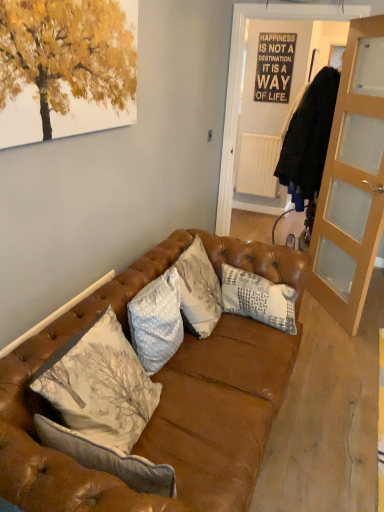
How much space does light gray textured pillow at center, placed as the second pillow when sorted from back to front, occupy horizontally?

The width of light gray textured pillow at center, placed as the second pillow when sorted from back to front, is 7.48 inches.

The height and width of the screenshot is (512, 384). I want to click on light gray textured pillow at center, placed as the second pillow when sorted from back to front, so click(x=156, y=321).

Consider the image. Is gray textured pillow at center, which is the 2th pillow in left-to-right order, oriented away from black paper poster at upper center?

Correct, gray textured pillow at center, which is the 2th pillow in left-to-right order, is looking away from black paper poster at upper center.

Considering the relative sizes of gray textured pillow at center, which is the first pillow in back-to-front order, and black paper poster at upper center in the image provided, is gray textured pillow at center, which is the first pillow in back-to-front order, shorter than black paper poster at upper center?

Yes, gray textured pillow at center, which is the first pillow in back-to-front order, is shorter than black paper poster at upper center.

From the picture: From the image's perspective, would you say gray textured pillow at center, which is the first pillow in back-to-front order, is shown under black paper poster at upper center?

Indeed, from the image's perspective, gray textured pillow at center, which is the first pillow in back-to-front order, is shown beneath black paper poster at upper center.

Does gray textured pillow at center, acting as the 2th pillow starting from the front, have a greater width compared to black paper poster at upper center?

Correct, the width of gray textured pillow at center, acting as the 2th pillow starting from the front, exceeds that of black paper poster at upper center.

Is white matte radiator at center closer to the viewer compared to leather couch at center?

No, it is behind leather couch at center.

Is white matte radiator at center looking in the opposite direction of leather couch at center?

No, white matte radiator at center's orientation is not away from leather couch at center.

In terms of size, does white matte radiator at center appear bigger or smaller than leather couch at center?

In the image, white matte radiator at center appears to be smaller than leather couch at center.

Is white matte radiator at center touching leather couch at center?

white matte radiator at center and leather couch at center are clearly separated.

Considering the relative sizes of leather couch at center and light brown glass cabinet at right in the image provided, is leather couch at center smaller than light brown glass cabinet at right?

Incorrect, leather couch at center is not smaller in size than light brown glass cabinet at right.

Between point (9, 354) and point (334, 238), which one is positioned in front?

The point (9, 354) is closer to the camera.

Is leather couch at center positioned beyond the bounds of light brown glass cabinet at right?

leather couch at center is positioned outside light brown glass cabinet at right.

Is light brown glass cabinet at right in contact with gray textured pillow at center, the first pillow positioned from the right?

They are not placed beside each other.

Which object is positioned more to the left, light brown glass cabinet at right or gray textured pillow at center, which is the 2th pillow in left-to-right order?

Positioned to the left is gray textured pillow at center, which is the 2th pillow in left-to-right order.

Is gray textured pillow at center, which is the 2th pillow in left-to-right order, located within light brown glass cabinet at right?

No.

Considering the points (348, 290) and (245, 281), which point is in front, point (348, 290) or point (245, 281)?

The point (245, 281) is more forward.

In the scene shown: Visually, is white matte radiator at center positioned to the left or to the right of gray textured pillow at center, the first pillow positioned from the right?

white matte radiator at center is positioned on gray textured pillow at center, the first pillow positioned from the right,'s right side.

From a real-world perspective, relative to gray textured pillow at center, acting as the 2th pillow starting from the front, is white matte radiator at center vertically above or below?

From a real-world perspective, white matte radiator at center is physically above gray textured pillow at center, acting as the 2th pillow starting from the front.

At what (x,y) coordinates should I click in order to perform the action: click on radiator that is above the gray textured pillow at center, which is the first pillow in back-to-front order (from the image's perspective). Please return your answer as a coordinate pair (x, y). Looking at the image, I should click on coord(258,165).

Is point (268, 169) closer or farther from the camera than point (282, 290)?

Point (268, 169) is farther from the camera than point (282, 290).

Is point (165, 366) closer to viewer compared to point (165, 284)?

That is True.

Would you say leather couch at center is outside light gray textured pillow at center, which is counted as the first pillow, starting from the front?

Absolutely, leather couch at center is external to light gray textured pillow at center, which is counted as the first pillow, starting from the front.

From the image's perspective, who appears lower, leather couch at center or light gray textured pillow at center, acting as the 1th pillow starting from the left?

leather couch at center appears lower in the image.

Which object is thinner, leather couch at center or light gray textured pillow at center, placed as the second pillow when sorted from back to front?

With smaller width is light gray textured pillow at center, placed as the second pillow when sorted from back to front.

Is black paper poster at upper center inside or outside of light brown glass cabinet at right?

The correct answer is: outside.

Can you see black paper poster at upper center touching light brown glass cabinet at right?

No, black paper poster at upper center is not touching light brown glass cabinet at right.

Considering the relative positions of black paper poster at upper center and light brown glass cabinet at right in the image provided, is black paper poster at upper center in front of light brown glass cabinet at right?

No, the depth of black paper poster at upper center is greater than that of light brown glass cabinet at right.

From the image's perspective, is black paper poster at upper center above or below light brown glass cabinet at right?

black paper poster at upper center is situated higher than light brown glass cabinet at right in the image.

At what (x,y) coordinates should I click in order to perform the action: click on the 1st pillow in front of the black paper poster at upper center, counting from the anchor's position. Please return your answer as a coordinate pair (x, y). This screenshot has width=384, height=512. Looking at the image, I should click on (258, 298).

This screenshot has height=512, width=384. In order to click on studio couch that is under the white matte radiator at center (from a real-world perspective) in this screenshot , I will do `click(165, 396)`.

Based on their spatial positions, is gray textured pillow at center, which is the 2th pillow in left-to-right order, or white matte radiator at center further from light brown glass cabinet at right?

white matte radiator at center lies further to light brown glass cabinet at right than the other object.

When comparing their distances from leather couch at center, does white matte radiator at center or black paper poster at upper center seem closer?

white matte radiator at center.

Considering their positions, is light gray textured pillow at center, placed as the second pillow when sorted from back to front, positioned further to leather couch at center than light brown glass cabinet at right?

Among the two, light brown glass cabinet at right is located further to leather couch at center.

From the image, which object appears to be nearer to light brown glass cabinet at right, light gray textured pillow at center, which is counted as the first pillow, starting from the front, or leather couch at center?

leather couch at center is positioned closer to the anchor light brown glass cabinet at right.

Based on their spatial positions, is black paper poster at upper center or gray textured pillow at center, which is the 2th pillow in left-to-right order, closer to light brown glass cabinet at right?

gray textured pillow at center, which is the 2th pillow in left-to-right order, is positioned closer to the anchor light brown glass cabinet at right.

Estimate the real-world distances between objects in this image. Which object is closer to leather couch at center, black paper poster at upper center or light gray textured pillow at center, placed as the second pillow when sorted from back to front?

light gray textured pillow at center, placed as the second pillow when sorted from back to front.

Looking at this image, when comparing their distances from black paper poster at upper center, does leather couch at center or white matte radiator at center seem closer?

The object closer to black paper poster at upper center is white matte radiator at center.

Which object lies further to the anchor point white matte radiator at center, leather couch at center or black paper poster at upper center?

leather couch at center lies further to white matte radiator at center than the other object.

The height and width of the screenshot is (512, 384). Find the location of `cabinetry between light gray textured pillow at center, which is counted as the first pillow, starting from the front, and black paper poster at upper center, along the z-axis`. cabinetry between light gray textured pillow at center, which is counted as the first pillow, starting from the front, and black paper poster at upper center, along the z-axis is located at coordinates point(352,181).

The height and width of the screenshot is (512, 384). I want to click on bulletin board between leather couch at center and white matte radiator at center from front to back, so click(274, 67).

The image size is (384, 512). I want to click on cabinetry between leather couch at center and black paper poster at upper center from front to back, so click(x=352, y=181).

Locate an element on the screen. Image resolution: width=384 pixels, height=512 pixels. bulletin board positioned between light brown glass cabinet at right and white matte radiator at center from near to far is located at coordinates (274, 67).